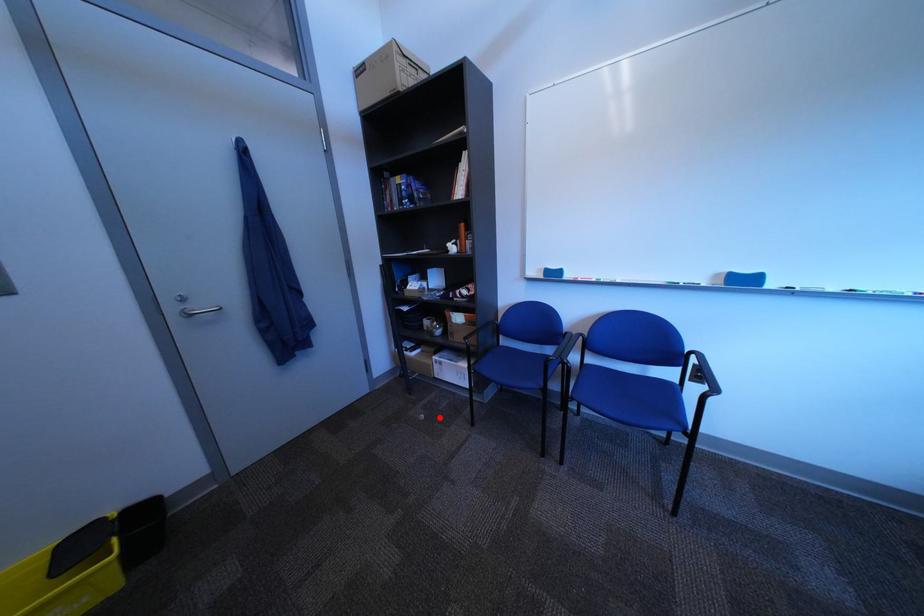
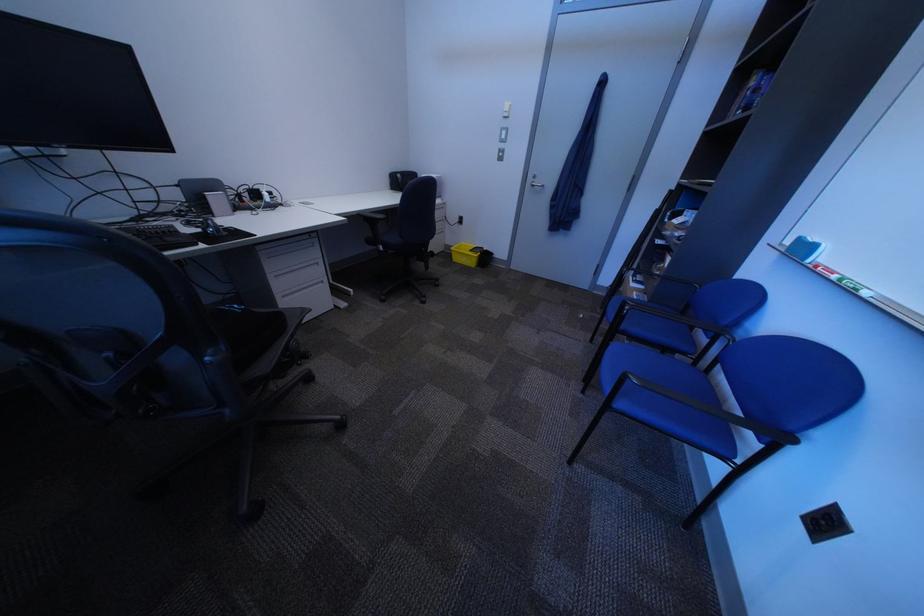
Question: I am providing you with two images of the same scene from different viewpoints. A red point is marked on the first image. Is the red point's position out of view in image 2?

Choices:
 (A) Yes
 (B) No

Answer: (B)